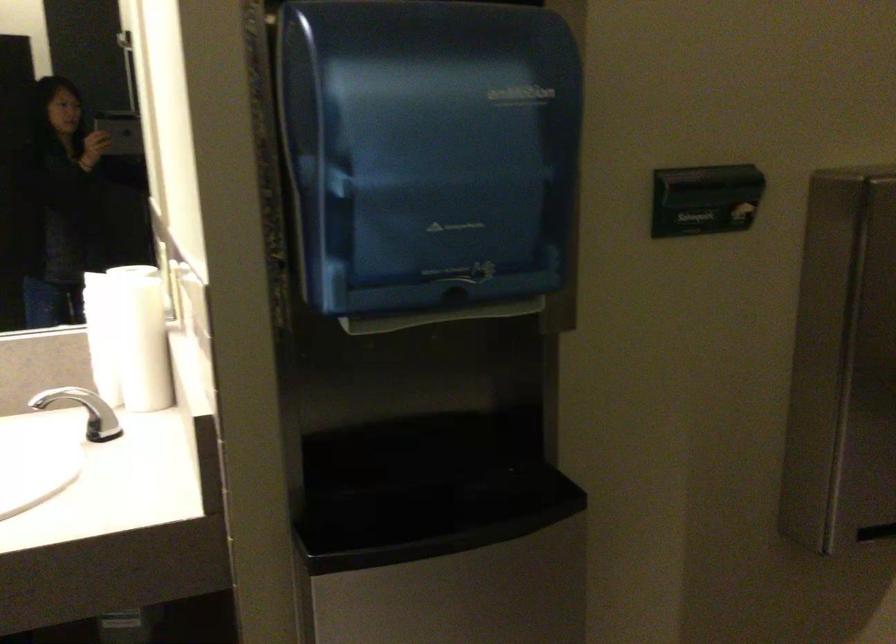
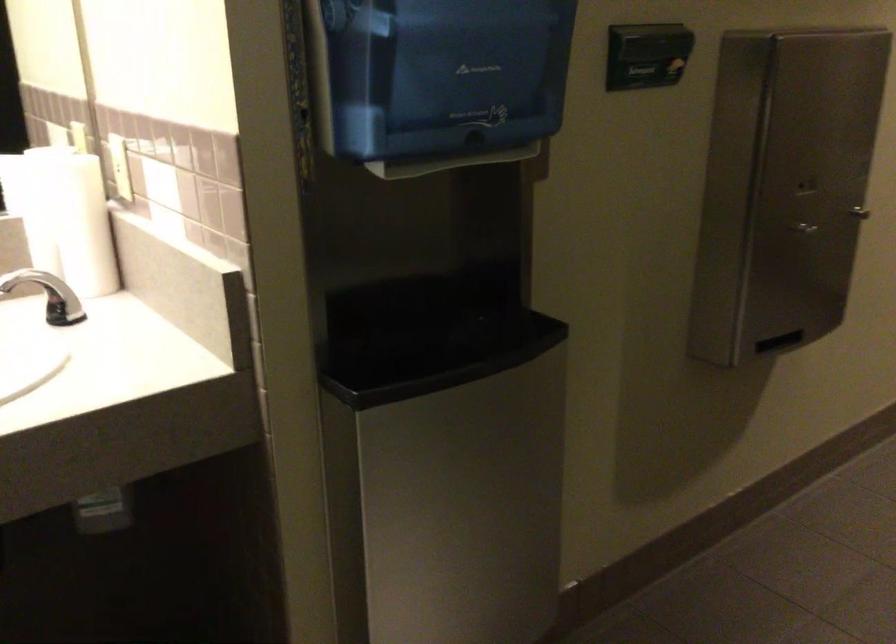
Question: The camera is either moving clockwise (left) or counter-clockwise (right) around the object. The first image is from the beginning of the video and the second image is from the end. Is the camera moving left or right when shooting the video?

Choices:
 (A) Left
 (B) Right

Answer: (A)